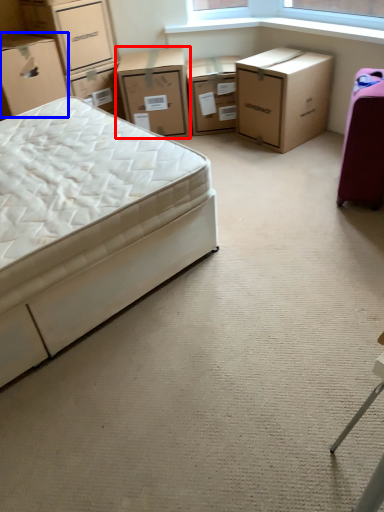
Question: Which object appears farthest to the camera in this image, chest of drawers (highlighted by a red box) or box (highlighted by a blue box)?

Choices:
 (A) chest of drawers
 (B) box

Answer: (A)